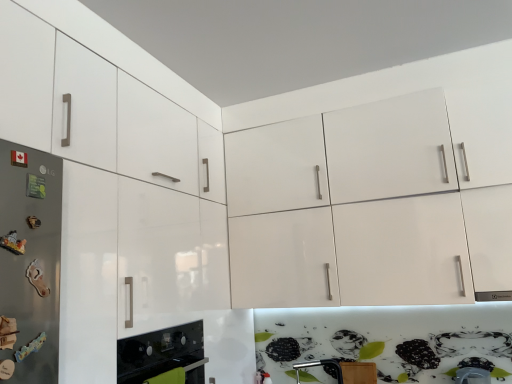
What do you see at coordinates (163, 356) in the screenshot?
I see `black glass oven at lower left` at bounding box center [163, 356].

Where is `satin silver refrigerator at left`? This screenshot has width=512, height=384. satin silver refrigerator at left is located at coordinates (29, 263).

Locate an element on the screen. The image size is (512, 384). metallic screwdriver at lower center is located at coordinates click(x=323, y=366).

Does point (336, 373) come closer to viewer compared to point (110, 380)?

No, (336, 373) is behind (110, 380).

Is metallic screwdriver at lower center bigger than glossy white cabinet at upper left?

Incorrect, metallic screwdriver at lower center is not larger than glossy white cabinet at upper left.

Is metallic screwdriver at lower center thinner than glossy white cabinet at upper left?

Correct, the width of metallic screwdriver at lower center is less than that of glossy white cabinet at upper left.

Which is in front, point (164, 343) or point (96, 109)?

Positioned in front is point (96, 109).

Is black glass oven at lower left looking in the opposite direction of glossy white cabinet at upper left?

Yes, glossy white cabinet at upper left is at the back of black glass oven at lower left.

From a real-world perspective, is black glass oven at lower left above or below glossy white cabinet at upper left?

Clearly, from a real-world perspective, black glass oven at lower left is below glossy white cabinet at upper left.

How different are the orientations of black glass oven at lower left and glossy white cabinet at upper left in degrees?

The angle between the facing direction of black glass oven at lower left and the facing direction of glossy white cabinet at upper left is 0.000484 degrees.

What's the angular difference between glossy white cabinet at upper left and metallic screwdriver at lower center's facing directions?

89 degrees.

From a real-world perspective, does glossy white cabinet at upper left sit lower than metallic screwdriver at lower center?

No, from a real-world perspective, glossy white cabinet at upper left is not below metallic screwdriver at lower center.

Does point (127, 88) appear closer or farther from the camera than point (331, 375)?

Point (127, 88) is positioned closer to the camera compared to point (331, 375).

Which object is positioned more to the right, glossy white cabinet at upper left or metallic screwdriver at lower center?

metallic screwdriver at lower center is more to the right.

Would you say black glass oven at lower left is part of glossy white cabinet at upper left's contents?

That's correct, black glass oven at lower left is inside glossy white cabinet at upper left.

Can you confirm if glossy white cabinet at upper left is wider than black glass oven at lower left?

Indeed, glossy white cabinet at upper left has a greater width compared to black glass oven at lower left.

From the image's perspective, is glossy white cabinet at upper left below black glass oven at lower left?

No, from the image's perspective, glossy white cabinet at upper left is not beneath black glass oven at lower left.

Which is closer to the camera, (176, 163) or (175, 383)?

Point (176, 163) appears to be farther away from the viewer than point (175, 383).

From the image's perspective, which is below, metallic screwdriver at lower center or black glass oven at lower left?

metallic screwdriver at lower center.

Considering the relative sizes of metallic screwdriver at lower center and black glass oven at lower left in the image provided, is metallic screwdriver at lower center taller than black glass oven at lower left?

Incorrect, the height of metallic screwdriver at lower center is not larger of that of black glass oven at lower left.

Is point (332, 367) behind point (163, 365)?

Yes, it is behind point (163, 365).

From a real-world perspective, who is located higher, metallic screwdriver at lower center or black glass oven at lower left?

black glass oven at lower left.

Locate an element on the screen. fridge below the glossy white cabinet at upper left (from a real-world perspective) is located at coordinates (29, 263).

What's the angular difference between satin silver refrigerator at left and glossy white cabinet at upper left's facing directions?

The facing directions of satin silver refrigerator at left and glossy white cabinet at upper left are 2.38 degrees apart.

Is satin silver refrigerator at left looking in the opposite direction of glossy white cabinet at upper left?

That's right, satin silver refrigerator at left is facing away from glossy white cabinet at upper left.

Do you think satin silver refrigerator at left is within glossy white cabinet at upper left, or outside of it?

satin silver refrigerator at left is spatially situated outside glossy white cabinet at upper left.

Is glossy white cabinet at upper left placed right next to satin silver refrigerator at left?

No.

Is glossy white cabinet at upper left surrounding satin silver refrigerator at left?

No, satin silver refrigerator at left is not inside glossy white cabinet at upper left.

Is glossy white cabinet at upper left facing away from satin silver refrigerator at left?

glossy white cabinet at upper left is not turned away from satin silver refrigerator at left.

The width and height of the screenshot is (512, 384). Identify the location of fridge behind the glossy white cabinet at upper left. (29, 263).

Where is `cabinetry in front of the metallic screwdriver at lower center`? cabinetry in front of the metallic screwdriver at lower center is located at coordinates (117, 176).

Where is `home appliance located below the glossy white cabinet at upper left (from the image's perspective)`? home appliance located below the glossy white cabinet at upper left (from the image's perspective) is located at coordinates (163, 356).

When comparing their distances from metallic screwdriver at lower center, does black glass oven at lower left or glossy white cabinet at upper left seem further?

The object further to metallic screwdriver at lower center is glossy white cabinet at upper left.

From the picture: Considering their positions, is satin silver refrigerator at left positioned further to metallic screwdriver at lower center than glossy white cabinet at upper left?

Among the two, satin silver refrigerator at left is located further to metallic screwdriver at lower center.

Considering their positions, is glossy white cabinet at upper left positioned closer to metallic screwdriver at lower center than black glass oven at lower left?

The object closer to metallic screwdriver at lower center is black glass oven at lower left.

Which object lies nearer to the anchor point black glass oven at lower left, satin silver refrigerator at left or metallic screwdriver at lower center?

satin silver refrigerator at left is closer to black glass oven at lower left.

Based on their spatial positions, is glossy white cabinet at upper left or satin silver refrigerator at left closer to metallic screwdriver at lower center?

Based on the image, glossy white cabinet at upper left appears to be nearer to metallic screwdriver at lower center.

Which object lies nearer to the anchor point metallic screwdriver at lower center, black glass oven at lower left or satin silver refrigerator at left?

black glass oven at lower left lies closer to metallic screwdriver at lower center than the other object.

Looking at the image, which one is located closer to black glass oven at lower left, satin silver refrigerator at left or glossy white cabinet at upper left?

Based on the image, glossy white cabinet at upper left appears to be nearer to black glass oven at lower left.

Consider the image. Which object lies further to the anchor point glossy white cabinet at upper left, black glass oven at lower left or metallic screwdriver at lower center?

Among the two, metallic screwdriver at lower center is located further to glossy white cabinet at upper left.

Where is `home appliance between satin silver refrigerator at left and metallic screwdriver at lower center in the front-back direction`? The height and width of the screenshot is (384, 512). home appliance between satin silver refrigerator at left and metallic screwdriver at lower center in the front-back direction is located at coordinates (163, 356).

Find the location of a particular element. Image resolution: width=512 pixels, height=384 pixels. home appliance between glossy white cabinet at upper left and metallic screwdriver at lower center in the front-back direction is located at coordinates (163, 356).

I want to click on fridge between glossy white cabinet at upper left and black glass oven at lower left in the front-back direction, so click(29, 263).

Identify the location of fridge located between glossy white cabinet at upper left and metallic screwdriver at lower center in the depth direction. (29, 263).